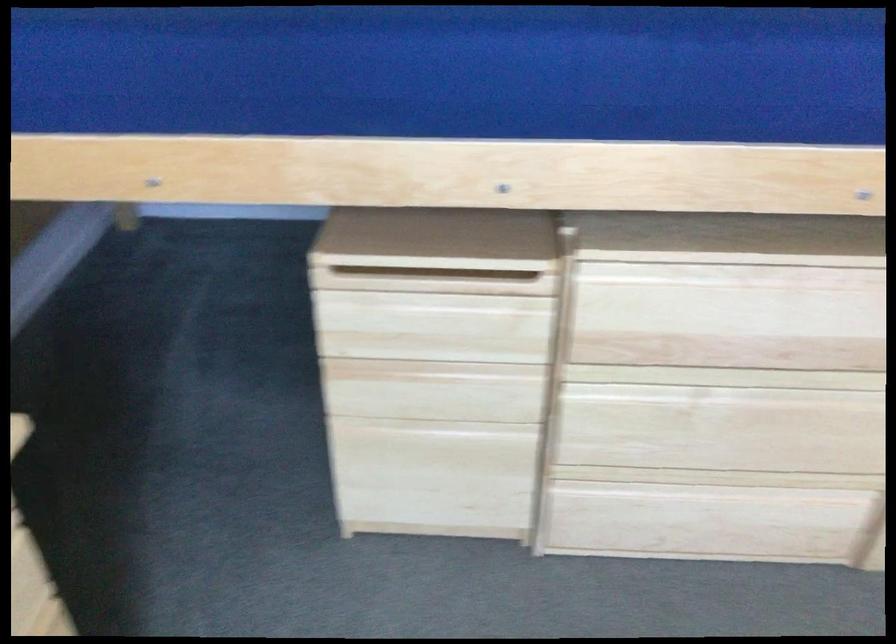
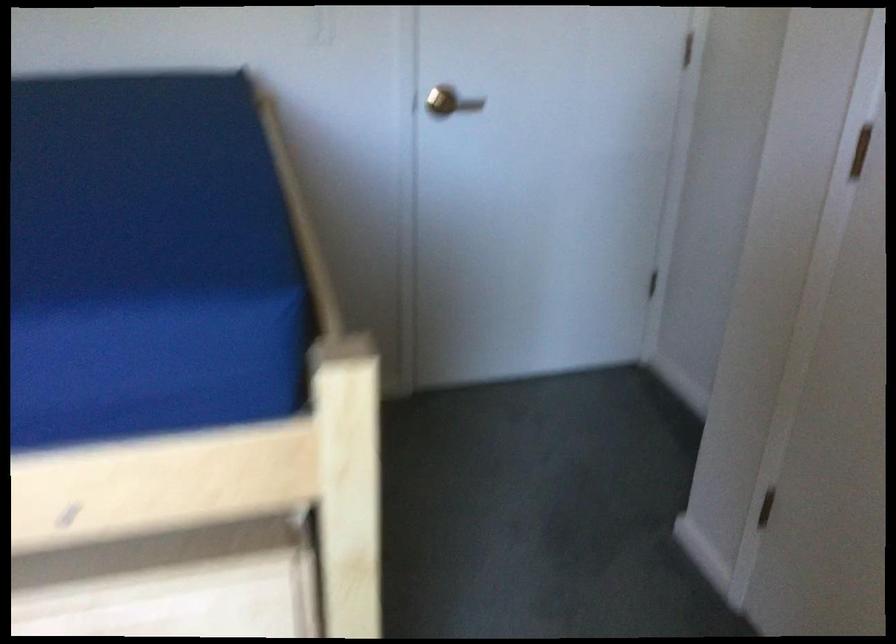
Question: How did the camera likely rotate?

Choices:
 (A) Left
 (B) Right
 (C) Up
 (D) Down

Answer: (B)